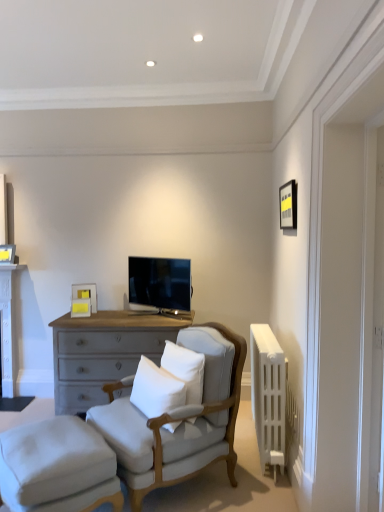
Question: Are white painted wood table at left and white soft cushion at center, which is the first pillow from left to right, located far from each other?

Choices:
 (A) yes
 (B) no

Answer: (A)

Question: Is white painted wood table at left aimed at white soft cushion at center, the 2th pillow in the right-to-left sequence?

Choices:
 (A) yes
 (B) no

Answer: (B)

Question: Is the surface of white painted wood table at left in direct contact with white soft cushion at center, the 2th pillow in the right-to-left sequence?

Choices:
 (A) no
 (B) yes

Answer: (A)

Question: Is white painted wood table at left at the right side of white soft cushion at center, the 2th pillow in the right-to-left sequence?

Choices:
 (A) no
 (B) yes

Answer: (A)

Question: From the image's perspective, is white painted wood table at left on white soft cushion at center, which is the first pillow from left to right?

Choices:
 (A) yes
 (B) no

Answer: (A)

Question: From the image's perspective, is light gray fabric chair at center above or below white soft cushion at center, which is the first pillow from left to right?

Choices:
 (A) below
 (B) above

Answer: (A)

Question: Is light gray fabric chair at center in front of or behind white soft cushion at center, which is the first pillow from left to right, in the image?

Choices:
 (A) front
 (B) behind

Answer: (A)

Question: Considering the relative positions of light gray fabric chair at center and white soft cushion at center, which is the first pillow from left to right, in the image provided, is light gray fabric chair at center to the left or to the right of white soft cushion at center, which is the first pillow from left to right,?

Choices:
 (A) right
 (B) left

Answer: (A)

Question: Is light gray fabric chair at center taller or shorter than white soft cushion at center, which is the first pillow from left to right?

Choices:
 (A) short
 (B) tall

Answer: (B)

Question: Considering the positions of point (157, 369) and point (1, 288), is point (157, 369) closer or farther from the camera than point (1, 288)?

Choices:
 (A) closer
 (B) farther

Answer: (A)

Question: Do you think white soft cushion at center, the 2th pillow in the right-to-left sequence, is within white painted wood table at left, or outside of it?

Choices:
 (A) outside
 (B) inside

Answer: (A)

Question: From a real-world perspective, is white soft cushion at center, which is the first pillow from left to right, positioned above or below white painted wood table at left?

Choices:
 (A) below
 (B) above

Answer: (A)

Question: From the image's perspective, is white soft cushion at center, which is the first pillow from left to right, above or below white painted wood table at left?

Choices:
 (A) below
 (B) above

Answer: (A)

Question: Based on their sizes in the image, would you say light gray fabric chair at center is bigger or smaller than white plastic radiator at right?

Choices:
 (A) small
 (B) big

Answer: (B)

Question: Is light gray fabric chair at center taller or shorter than white plastic radiator at right?

Choices:
 (A) short
 (B) tall

Answer: (B)